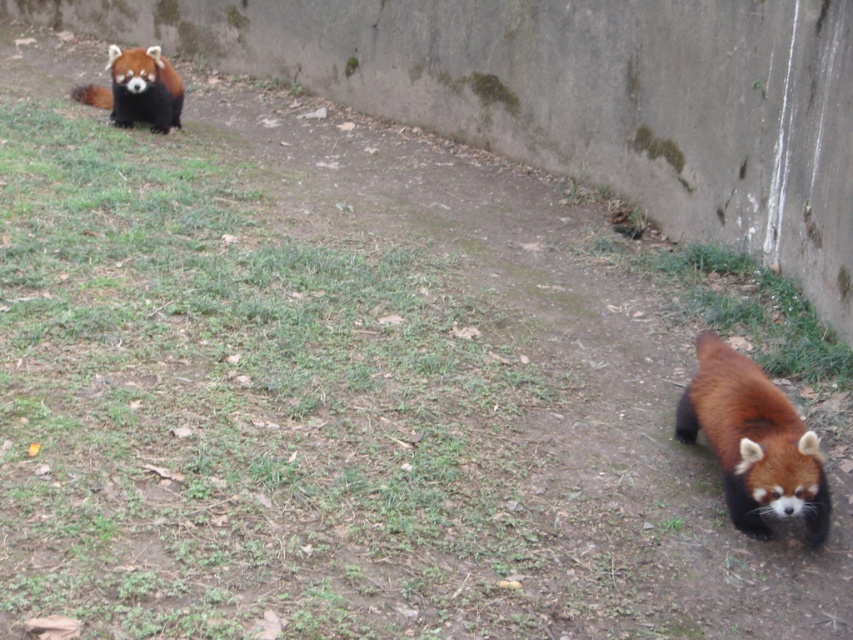
Question: Does fluffy reddish-brown pelt at lower right appear on the left side of fluffy reddish-brown red panda at upper left?

Choices:
 (A) yes
 (B) no

Answer: (B)

Question: Which object appears closest to the camera in this image?

Choices:
 (A) fluffy reddish-brown pelt at lower right
 (B) fluffy reddish-brown red panda at upper left

Answer: (A)

Question: From the image, what is the correct spatial relationship of fluffy reddish-brown pelt at lower right in relation to fluffy reddish-brown red panda at upper left?

Choices:
 (A) right
 (B) left

Answer: (A)

Question: Does fluffy reddish-brown pelt at lower right appear on the left side of fluffy reddish-brown red panda at upper left?

Choices:
 (A) no
 (B) yes

Answer: (A)

Question: Which point is farther to the camera?

Choices:
 (A) (91, 90)
 (B) (738, 374)

Answer: (A)